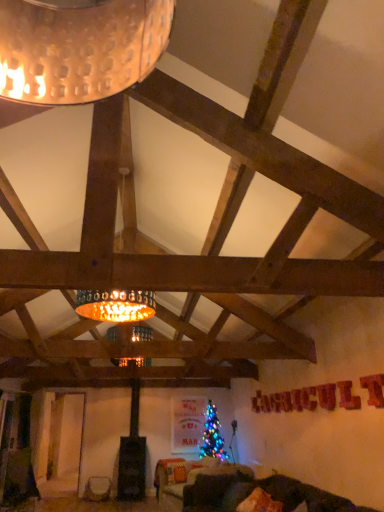
Question: In terms of width, does matte white vase at lower left look wider or thinner when compared to velvet orange pillow at lower center?

Choices:
 (A) wide
 (B) thin

Answer: (A)

Question: Considering the positions of matte white vase at lower left and velvet orange pillow at lower center in the image, is matte white vase at lower left taller or shorter than velvet orange pillow at lower center?

Choices:
 (A) short
 (B) tall

Answer: (B)

Question: Which object is the closest to the matte white vase at lower left?

Choices:
 (A) velvet dark green couch at lower center
 (B) velvet orange pillow at lower center

Answer: (A)

Question: Which object is the closest to the matte white vase at lower left?

Choices:
 (A) velvet orange pillow at lower center
 (B) velvet dark green couch at lower center

Answer: (B)